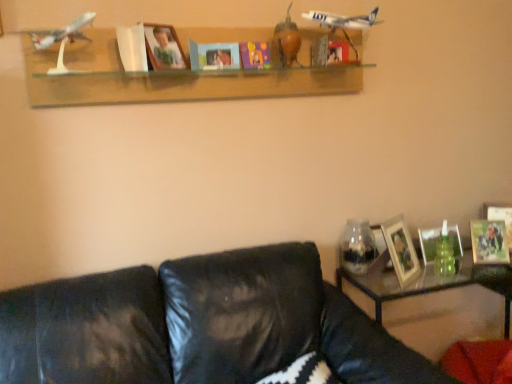
Question: Should I look upward or downward to see transparent glass jar at right?

Choices:
 (A) up
 (B) down

Answer: (B)

Question: Can you confirm if matte purple paper at center, which is the third paperback book in left-to-right order, is positioned to the left of clear glass table at lower right?

Choices:
 (A) yes
 (B) no

Answer: (A)

Question: Is matte purple paper at center, which is the third paperback book in left-to-right order, in front of clear glass table at lower right?

Choices:
 (A) yes
 (B) no

Answer: (B)

Question: Is matte purple paper at center, which is the third paperback book in left-to-right order, not within clear glass table at lower right?

Choices:
 (A) yes
 (B) no

Answer: (A)

Question: Considering the relative sizes of matte purple paper at center, which is the third paperback book in left-to-right order, and clear glass table at lower right in the image provided, is matte purple paper at center, which is the third paperback book in left-to-right order, smaller than clear glass table at lower right?

Choices:
 (A) no
 (B) yes

Answer: (B)

Question: Is matte purple paper at center, which is the third paperback book in left-to-right order, thinner than clear glass table at lower right?

Choices:
 (A) yes
 (B) no

Answer: (A)

Question: Is matte purple paper at center, which ranks as the 1th paperback book in right-to-left order, further to camera compared to clear glass table at lower right?

Choices:
 (A) no
 (B) yes

Answer: (B)

Question: Is black textured pillow at lower center located within wooden photo frame at right, which ranks as the fifth picture frame in top-to-bottom order?

Choices:
 (A) yes
 (B) no

Answer: (B)

Question: Is wooden photo frame at right, the second picture frame in the left-to-right sequence, touching black textured pillow at lower center?

Choices:
 (A) no
 (B) yes

Answer: (A)

Question: Does wooden photo frame at right, placed as the fourth picture frame when sorted from right to left, have a lesser width compared to black textured pillow at lower center?

Choices:
 (A) no
 (B) yes

Answer: (B)

Question: Could you tell me if wooden photo frame at right, placed as the fourth picture frame when sorted from right to left, is turned towards black textured pillow at lower center?

Choices:
 (A) yes
 (B) no

Answer: (B)

Question: Is wooden photo frame at right, the second picture frame in the left-to-right sequence, to the left of black textured pillow at lower center from the viewer's perspective?

Choices:
 (A) yes
 (B) no

Answer: (B)

Question: Considering the relative sizes of wooden photo frame at right, which ranks as the fifth picture frame in top-to-bottom order, and black textured pillow at lower center in the image provided, is wooden photo frame at right, which ranks as the fifth picture frame in top-to-bottom order, smaller than black textured pillow at lower center?

Choices:
 (A) yes
 (B) no

Answer: (A)

Question: Does blue matte book at center, which is counted as the second paperback book, starting from the right, have a lesser width compared to metallic silver photo frame at right, which is counted as the 2th picture frame, starting from the bottom?

Choices:
 (A) no
 (B) yes

Answer: (A)